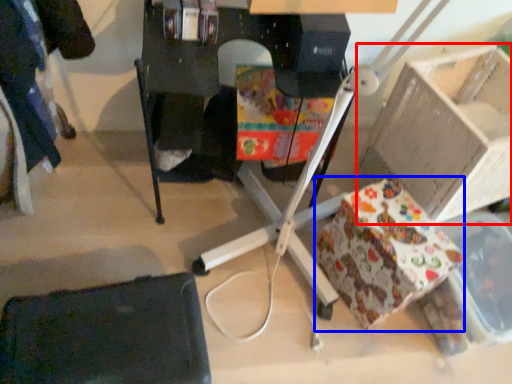
Question: Which object is closer to the camera taking this photo, cardboard box (highlighted by a red box) or wrapping paper (highlighted by a blue box)?

Choices:
 (A) cardboard box
 (B) wrapping paper

Answer: (A)